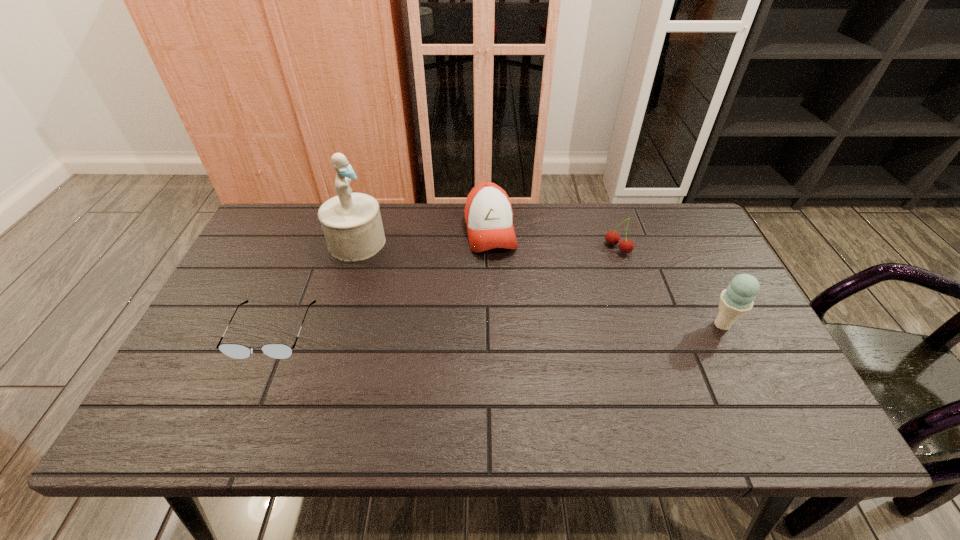
Locate an element on the screen. Image resolution: width=960 pixels, height=540 pixels. spectacles is located at coordinates (237, 351).

The image size is (960, 540). Identify the location of the second tallest object. (738, 299).

This screenshot has width=960, height=540. I want to click on the rightmost object, so click(738, 299).

This screenshot has height=540, width=960. Find the location of `the third object from right to left`. the third object from right to left is located at coordinates (488, 212).

Where is `figurine`? figurine is located at coordinates (351, 222).

I want to click on the second object from right to left, so click(612, 237).

Where is `vacant space situated on the lenses of the spectacles`? vacant space situated on the lenses of the spectacles is located at coordinates (252, 379).

You are a GUI agent. You are given a task and a screenshot of the screen. Output one action in this format:
    pyautogui.click(x=<x>, y=<y>)
    Task: Click on the free location located 0.070m on the front of the ice cream
    
    Given the screenshot: What is the action you would take?
    pyautogui.click(x=739, y=360)

Image resolution: width=960 pixels, height=540 pixels. I want to click on free space located on the front-facing side of the third object from right to left, so click(498, 275).

Locate an element on the screen. vacant space located on the front-facing side of the third object from right to left is located at coordinates (513, 337).